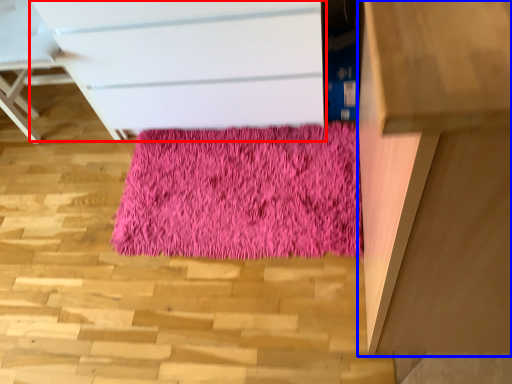
Question: Which point is closer to the camera, chest of drawers (highlighted by a red box) or furniture (highlighted by a blue box)?

Choices:
 (A) chest of drawers
 (B) furniture

Answer: (B)